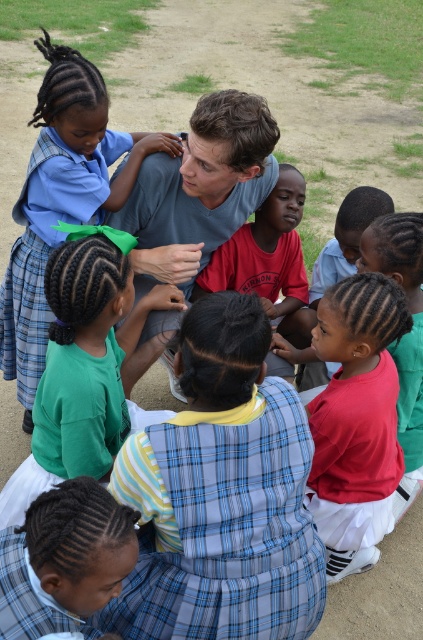
Is point (395, 305) farther from camera compared to point (184, 195)?

That is False.

Who is positioned more to the right, matte red shirt at lower right or light blue cotton shirt at center?

From the viewer's perspective, matte red shirt at lower right appears more on the right side.

The height and width of the screenshot is (640, 423). Identify the location of matte red shirt at lower right. (356, 420).

Is blue plaid dress at center to the right of matte red shirt at lower right from the viewer's perspective?

In fact, blue plaid dress at center is to the left of matte red shirt at lower right.

Between blue plaid dress at center and matte red shirt at lower right, which one has less height?

With less height is blue plaid dress at center.

At what (x,y) coordinates should I click in order to perform the action: click on blue plaid dress at center. Please return your answer as a coordinate pair (x, y). Looking at the image, I should click on (222, 493).

Between point (230, 561) and point (24, 524), which one is positioned behind?

The point (230, 561) is more distant.

Can you confirm if blue plaid dress at center is positioned below plaid fabric skirt at lower left?

No, blue plaid dress at center is not below plaid fabric skirt at lower left.

The width and height of the screenshot is (423, 640). I want to click on blue plaid dress at center, so click(x=222, y=493).